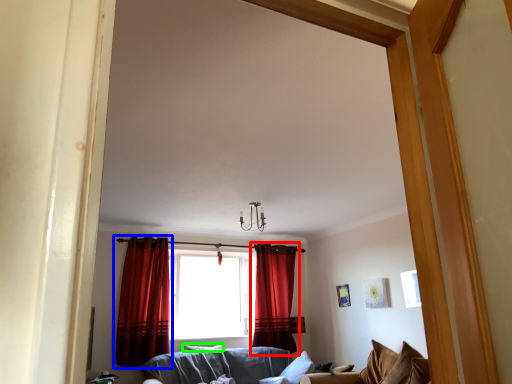
Question: Considering the real-world distances, which object is farthest from curtain (highlighted by a red box)? curtain (highlighted by a blue box) or pillow (highlighted by a green box)?

Choices:
 (A) curtain
 (B) pillow

Answer: (A)